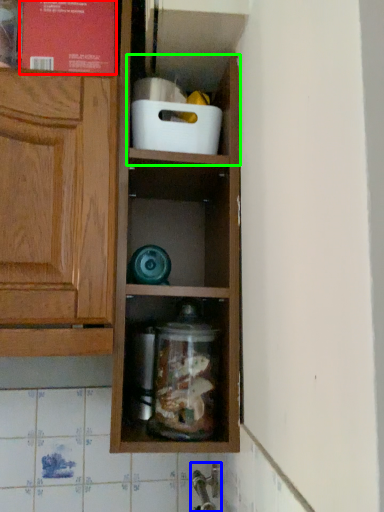
Question: Which is farther away from book (highlighted by a red box)? faucet (highlighted by a blue box) or cabinet (highlighted by a green box)?

Choices:
 (A) faucet
 (B) cabinet

Answer: (A)